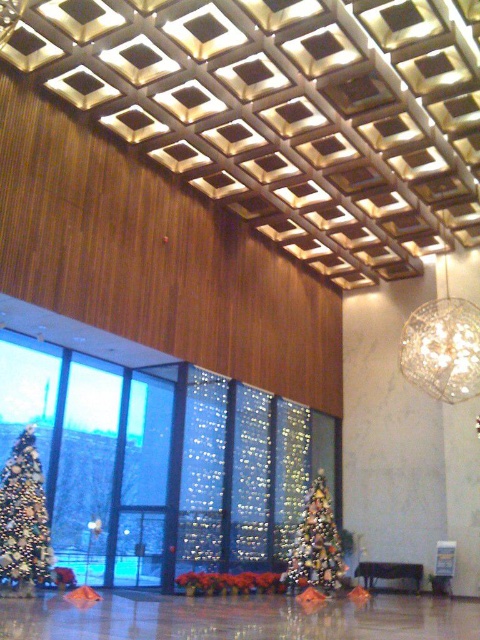
Is shiny gold christmas tree at left positioned at the back of shiny gold christmas tree at center?

That is False.

Between point (19, 502) and point (311, 486), which one is positioned in front?

Point (19, 502)

Image resolution: width=480 pixels, height=640 pixels. I want to click on shiny gold christmas tree at left, so click(24, 518).